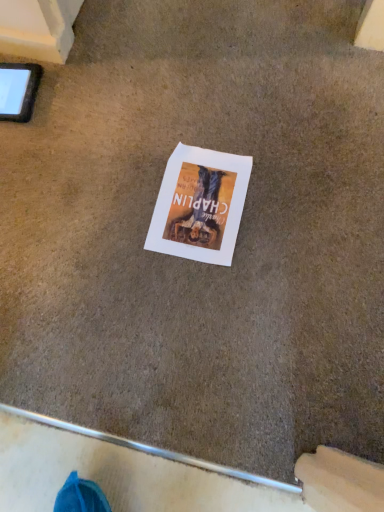
Find the location of a particular element. This screenshot has width=384, height=512. free spot in front of black matte tablet at upper left is located at coordinates (26, 164).